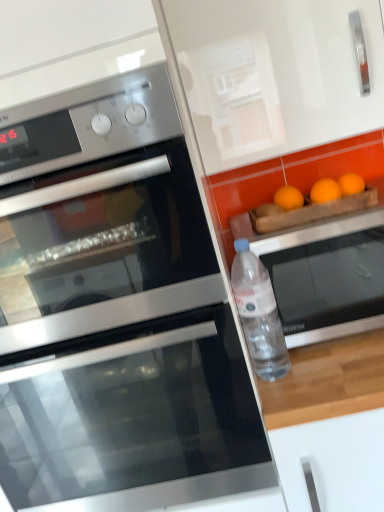
Question: Is the surface of transparent plastic bottle at right in direct contact with stainless steel oven at left, which ranks as the 1th oven in left-to-right order?

Choices:
 (A) yes
 (B) no

Answer: (B)

Question: Does transparent plastic bottle at right come in front of stainless steel oven at left, which appears as the 3th oven when viewed from the right?

Choices:
 (A) yes
 (B) no

Answer: (B)

Question: Is stainless steel oven at left, which appears as the 3th oven when viewed from the right, located within transparent plastic bottle at right?

Choices:
 (A) no
 (B) yes

Answer: (A)

Question: Can you confirm if transparent plastic bottle at right is wider than stainless steel oven at left, which appears as the 3th oven when viewed from the right?

Choices:
 (A) yes
 (B) no

Answer: (B)

Question: Considering the relative sizes of transparent plastic bottle at right and stainless steel oven at left, which ranks as the 1th oven in left-to-right order, in the image provided, is transparent plastic bottle at right taller than stainless steel oven at left, which ranks as the 1th oven in left-to-right order,?

Choices:
 (A) yes
 (B) no

Answer: (B)

Question: From a real-world perspective, is transparent plastic bottle at right located beneath stainless steel oven at left, which ranks as the 1th oven in left-to-right order?

Choices:
 (A) no
 (B) yes

Answer: (B)

Question: Is stainless steel oven at left, which ranks as the 1th oven in left-to-right order, at the left side of stainless steel oven at right, the 3th oven positioned from the left?

Choices:
 (A) no
 (B) yes

Answer: (B)

Question: Is stainless steel oven at left, which appears as the 3th oven when viewed from the right, not close to stainless steel oven at right, the 3th oven positioned from the left?

Choices:
 (A) no
 (B) yes

Answer: (A)

Question: Is stainless steel oven at right, the 3th oven positioned from the left, inside stainless steel oven at left, which appears as the 3th oven when viewed from the right?

Choices:
 (A) yes
 (B) no

Answer: (B)

Question: Considering the relative sizes of stainless steel oven at left, which ranks as the 1th oven in left-to-right order, and stainless steel oven at right, the 3th oven positioned from the left, in the image provided, is stainless steel oven at left, which ranks as the 1th oven in left-to-right order, shorter than stainless steel oven at right, the 3th oven positioned from the left,?

Choices:
 (A) no
 (B) yes

Answer: (A)

Question: From the image's perspective, is stainless steel oven at left, which appears as the 3th oven when viewed from the right, beneath stainless steel oven at right, which is the first oven in right-to-left order?

Choices:
 (A) yes
 (B) no

Answer: (B)

Question: Can you see stainless steel oven at left, which appears as the 3th oven when viewed from the right, touching stainless steel oven at right, the 3th oven positioned from the left?

Choices:
 (A) no
 (B) yes

Answer: (A)

Question: Considering the relative sizes of stainless steel oven at lower left, which ranks as the second oven in left-to-right order, and stainless steel oven at left, which appears as the 3th oven when viewed from the right, in the image provided, is stainless steel oven at lower left, which ranks as the second oven in left-to-right order, bigger than stainless steel oven at left, which appears as the 3th oven when viewed from the right,?

Choices:
 (A) yes
 (B) no

Answer: (A)